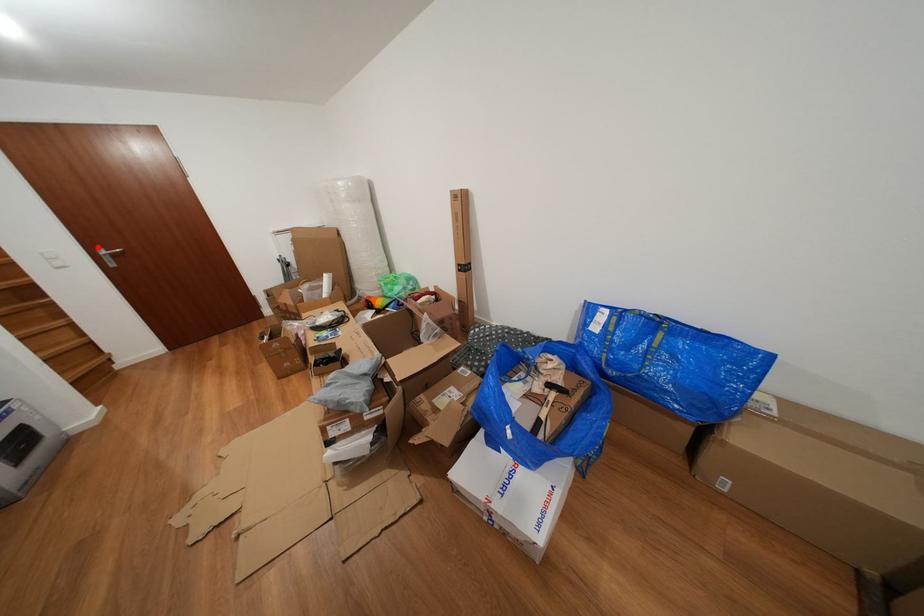
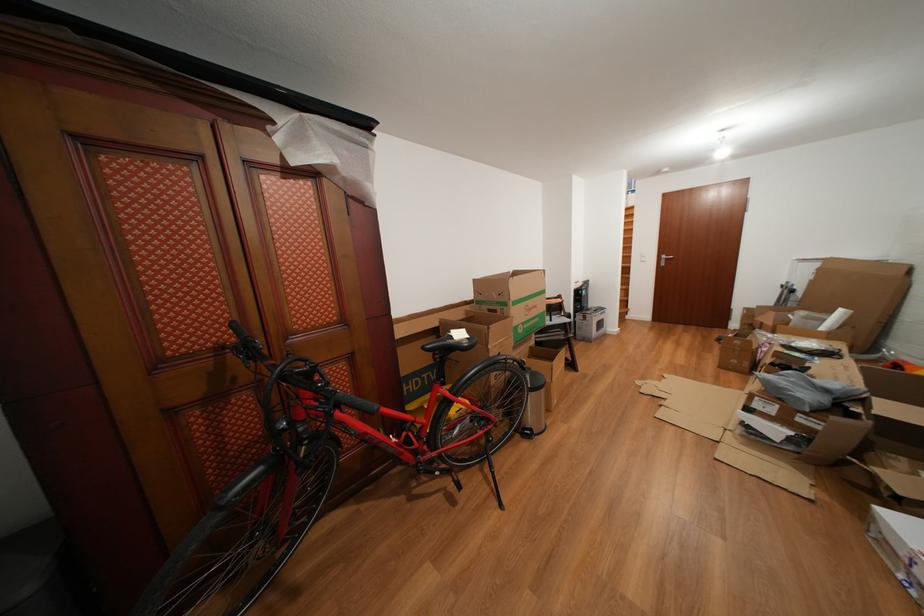
Question: I am providing you with two images of the same scene from different viewpoints. A red point is shown in image1. For the corresponding object point in image2, is it positioned nearer or farther from the camera?

Choices:
 (A) Nearer
 (B) Farther

Answer: (A)